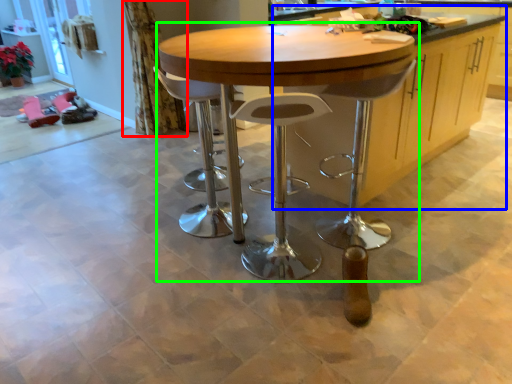
Question: Estimate the real-world distances between objects in this image. Which object is closer to curtain (highlighted by a red box), cabinetry (highlighted by a blue box) or table (highlighted by a green box)?

Choices:
 (A) cabinetry
 (B) table

Answer: (B)